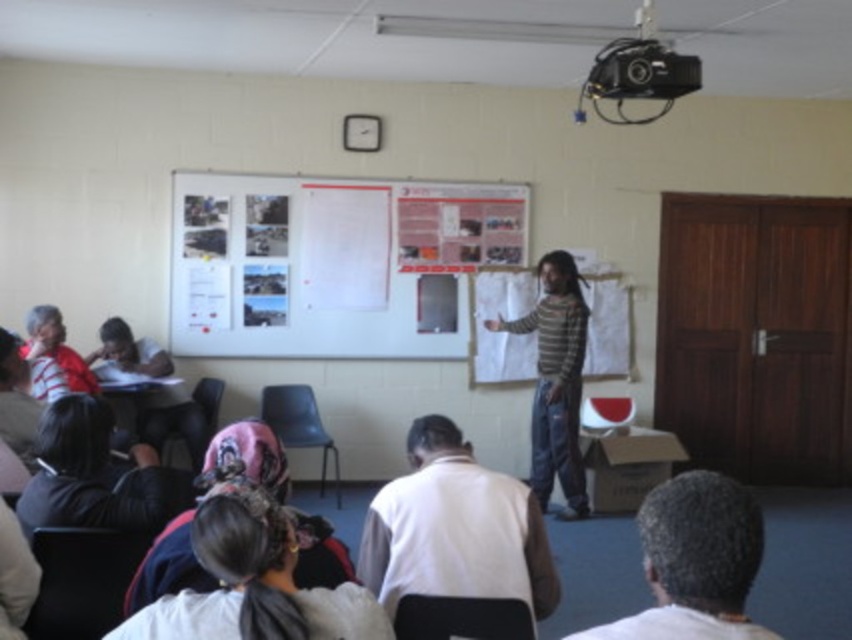
You are a student sitting in the classroom and want to point out something on the whiteboard. You notice a point at coordinates (x=95, y=476). Where exactly is this point located in relation to the dark brown hair at lower left?

The point at (x=95, y=476) is located on the dark brown hair at lower left.

You are a student sitting in the classroom. You need to locate the presenter who has dark brown hair at lower left. Where exactly should you look on the whiteboard?

The dark brown hair at lower left is located at point (95, 476) on the whiteboard.